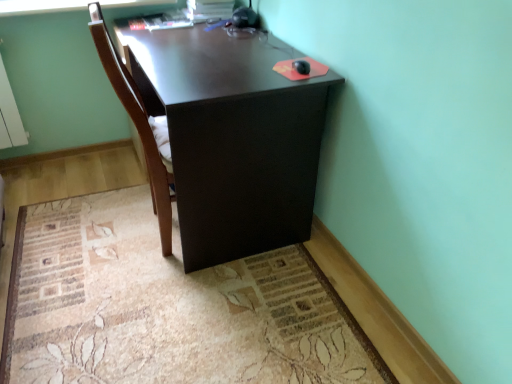
Question: Would you consider dark wood desk at center to be distant from beige carpet at lower center?

Choices:
 (A) yes
 (B) no

Answer: (B)

Question: Can you confirm if dark wood desk at center is wider than beige carpet at lower center?

Choices:
 (A) no
 (B) yes

Answer: (A)

Question: From the image's perspective, is dark wood desk at center below beige carpet at lower center?

Choices:
 (A) no
 (B) yes

Answer: (A)

Question: Does dark wood desk at center lie behind beige carpet at lower center?

Choices:
 (A) no
 (B) yes

Answer: (B)

Question: From a real-world perspective, is dark wood desk at center located beneath beige carpet at lower center?

Choices:
 (A) no
 (B) yes

Answer: (A)

Question: Is point (284, 243) closer or farther from the camera than point (150, 336)?

Choices:
 (A) closer
 (B) farther

Answer: (B)

Question: Is dark wood desk at center taller or shorter than beige carpet at lower center?

Choices:
 (A) short
 (B) tall

Answer: (B)

Question: From the image's perspective, relative to beige carpet at lower center, is dark wood desk at center above or below?

Choices:
 (A) above
 (B) below

Answer: (A)

Question: Based on their positions, is dark wood desk at center located to the left or right of beige carpet at lower center?

Choices:
 (A) right
 (B) left

Answer: (A)

Question: In terms of width, does beige carpet at lower center look wider or thinner when compared to brown wood chair at center?

Choices:
 (A) wide
 (B) thin

Answer: (A)

Question: Based on their sizes in the image, would you say beige carpet at lower center is bigger or smaller than brown wood chair at center?

Choices:
 (A) big
 (B) small

Answer: (B)

Question: From a real-world perspective, is beige carpet at lower center positioned above or below brown wood chair at center?

Choices:
 (A) below
 (B) above

Answer: (A)

Question: Is beige carpet at lower center to the left or to the right of brown wood chair at center in the image?

Choices:
 (A) right
 (B) left

Answer: (A)

Question: In terms of size, does dark wood desk at center appear bigger or smaller than brown wood chair at center?

Choices:
 (A) small
 (B) big

Answer: (B)

Question: Does point (189, 29) appear closer or farther from the camera than point (150, 188)?

Choices:
 (A) closer
 (B) farther

Answer: (A)